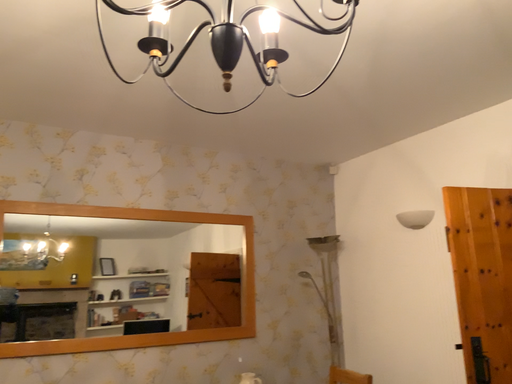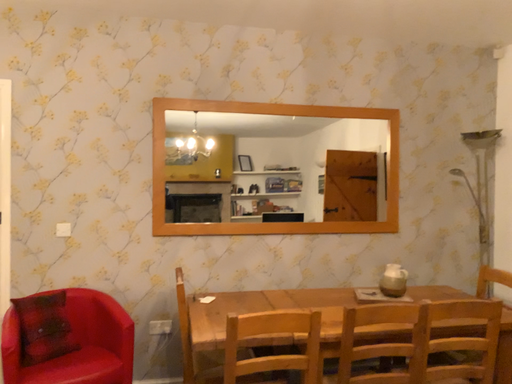
Question: How did the camera likely rotate when shooting the video?

Choices:
 (A) rotated left
 (B) rotated right

Answer: (A)